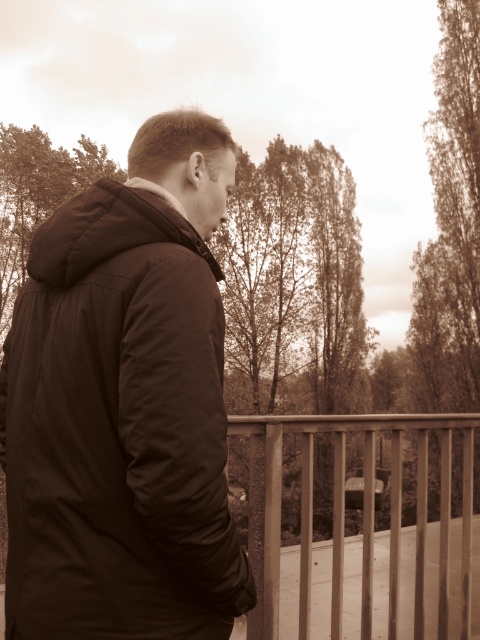
You are a photographer trying to capture a shot of the matte black jacket at center and the metallic silver fence at lower right. Based on their positions, which object would you focus on first to ensure both are in frame?

The matte black jacket at center is located above the metallic silver fence at lower right, so you should focus on the matte black jacket at center first to ensure both are in frame.